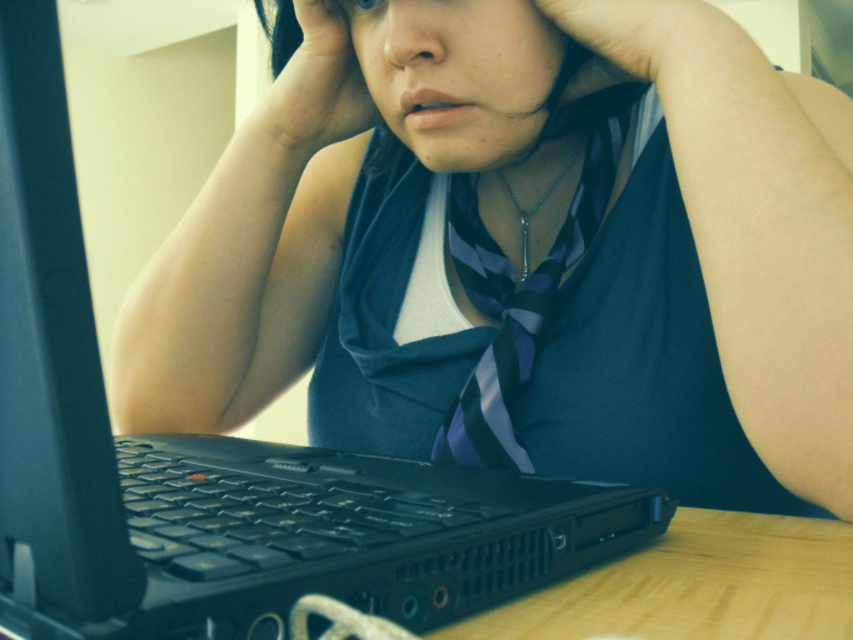
You are a photographer trying to capture a closeup of the hands in the scene. Which hand, the matte skin hand at upper center or the matte skin hand at center, should you focus on to ensure it appears sharper in the photo?

The matte skin hand at upper center is closer to the viewer, so focusing on it will make it appear sharper in the photo compared to the matte skin hand at center.